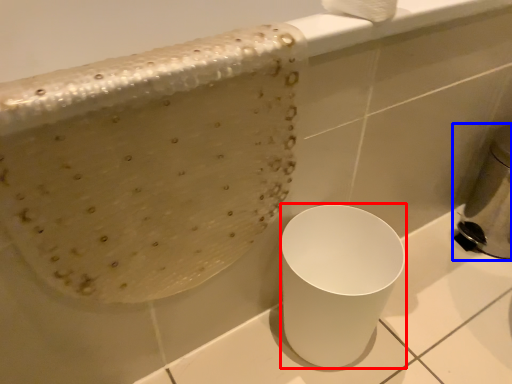
Question: Which object appears closest to the camera in this image, porcelain (highlighted by a red box) or appliance (highlighted by a blue box)?

Choices:
 (A) porcelain
 (B) appliance

Answer: (A)